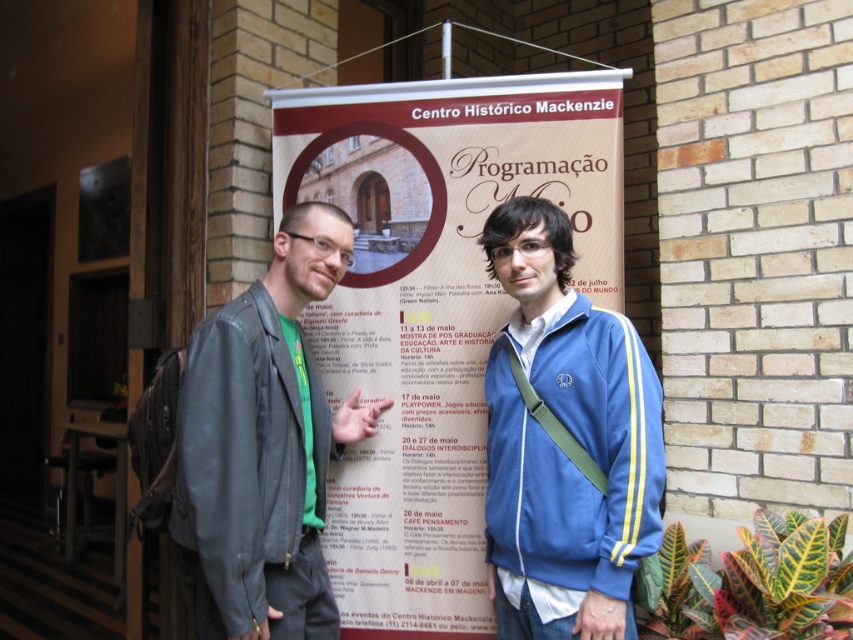
You are a photographer trying to capture both the blue fabric jacket at center and the leather jacket at center in a single shot. Since the camera has a limited depth of field, which jacket should you focus on to ensure the one closer to the camera is sharp?

The blue fabric jacket at center is above the leather jacket at center, so focusing on the blue fabric jacket at center ensures it is sharp since it is closer to the camera.

You are a photographer trying to capture a clear photo of the blue fabric jacket at center. However, the matte paper banner at center is blocking your view. Can you move around to the left side of the banner to get a better shot?

The blue fabric jacket at center is behind the matte paper banner at center, so moving to the left side of the banner might allow you to see around it and capture the jacket more clearly.

You are a photographer trying to capture both the matte paper banner at center and the blue fabric jacket at center in a single frame. Based on their sizes, do you think you can fit both objects into the camera view without moving the camera? Explain your reasoning.

The matte paper banner at center might be wider than blue fabric jacket at center, so there is a possibility that the banner could occupy more horizontal space. However, since both are at the center, adjusting the camera angle or zoom might help include both. But without knowing exact dimensions, it is uncertain if they will fit perfectly.